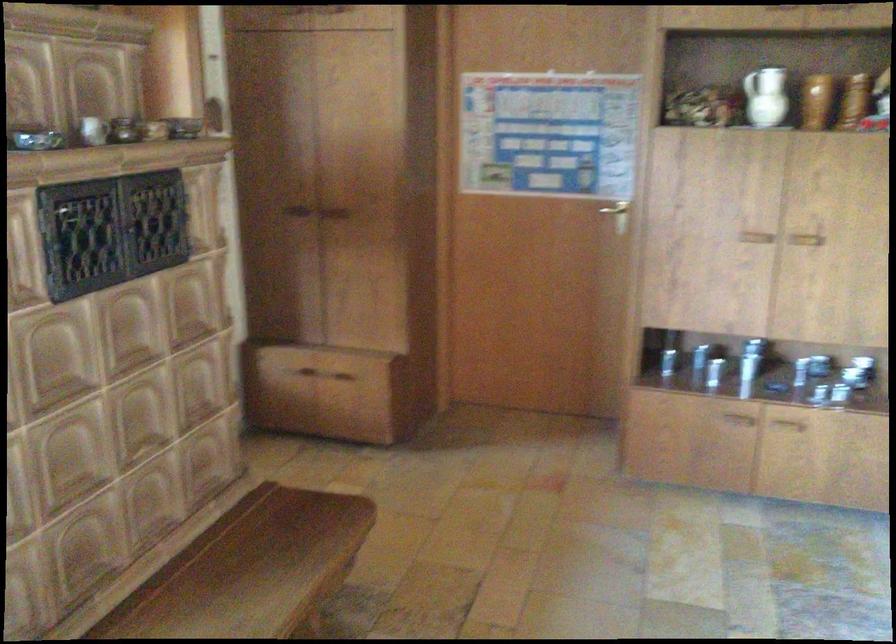
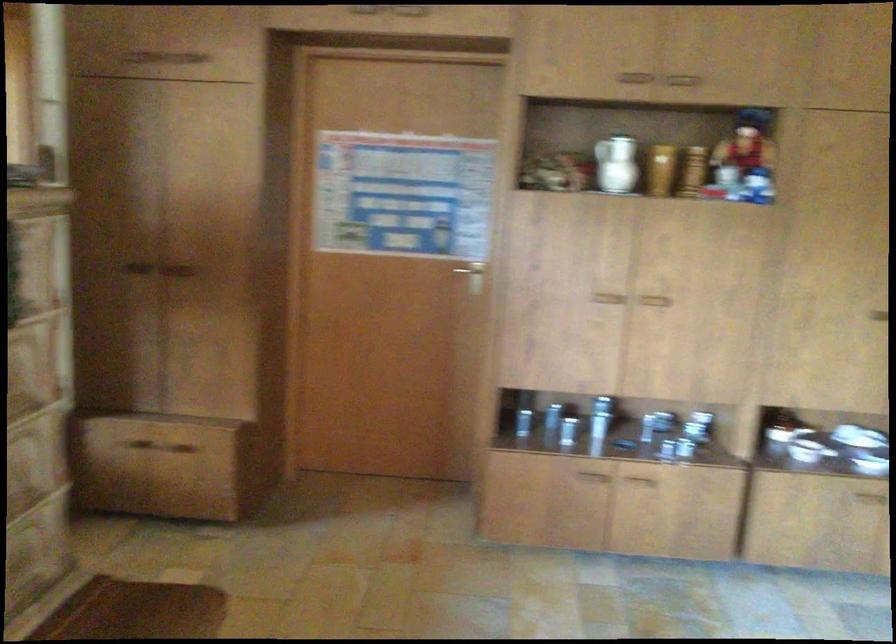
The point at (751, 357) is marked in the first image. Where is the corresponding point in the second image?

(606, 415)